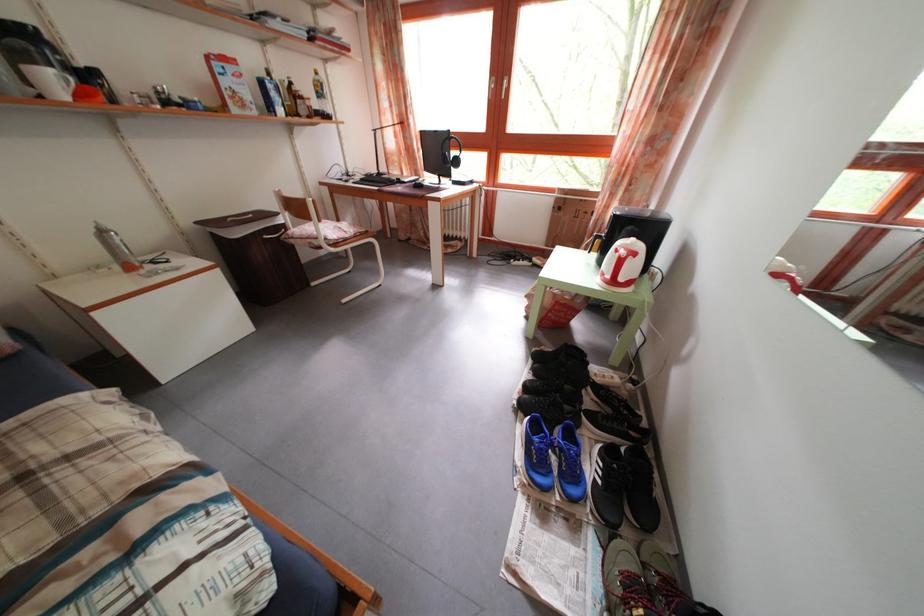
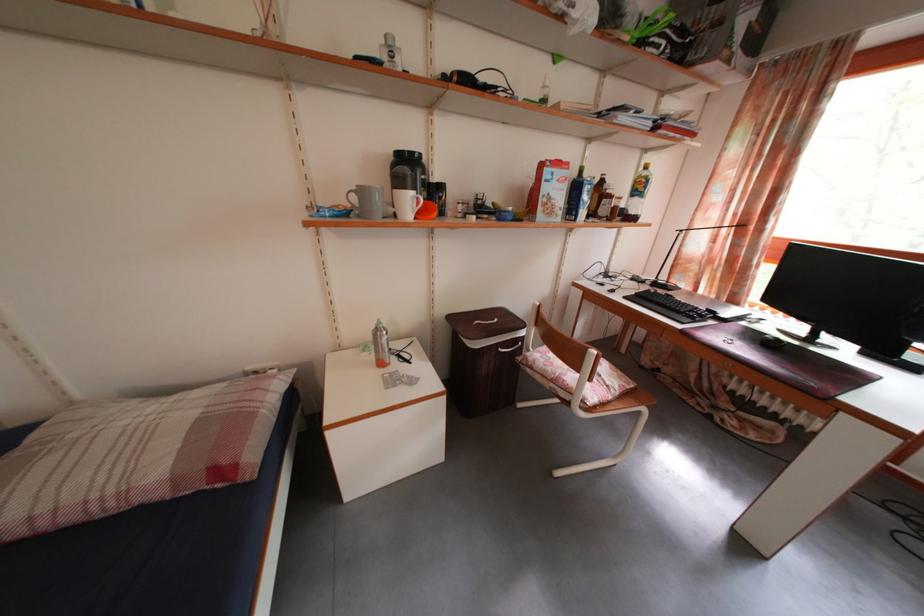
In the second image, find the point that corresponds to (x=315, y=248) in the first image.

(560, 392)